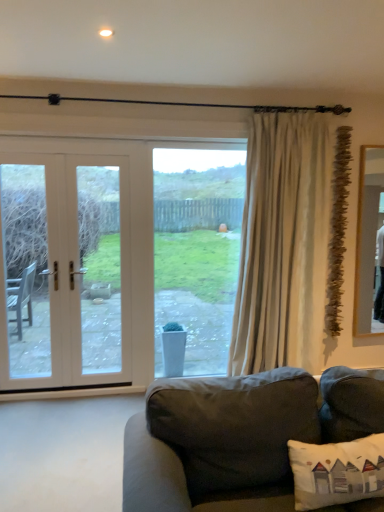
Question: Is white wood door at left not inside white fabric pillow at lower right?

Choices:
 (A) yes
 (B) no

Answer: (A)

Question: Is white wood door at left to the right of white fabric pillow at lower right from the viewer's perspective?

Choices:
 (A) yes
 (B) no

Answer: (B)

Question: Is white wood door at left to the left of white fabric pillow at lower right from the viewer's perspective?

Choices:
 (A) no
 (B) yes

Answer: (B)

Question: Is white fabric pillow at lower right a part of white wood door at left?

Choices:
 (A) no
 (B) yes

Answer: (A)

Question: From the image's perspective, is white wood door at left beneath white fabric pillow at lower right?

Choices:
 (A) no
 (B) yes

Answer: (A)

Question: From a real-world perspective, is white wood door at left located beneath white fabric pillow at lower right?

Choices:
 (A) no
 (B) yes

Answer: (A)

Question: Is dark gray fabric couch at lower center smaller than white wood door at left?

Choices:
 (A) no
 (B) yes

Answer: (A)

Question: Is the position of dark gray fabric couch at lower center less distant than that of white wood door at left?

Choices:
 (A) yes
 (B) no

Answer: (A)

Question: From the image's perspective, would you say dark gray fabric couch at lower center is positioned over white wood door at left?

Choices:
 (A) no
 (B) yes

Answer: (A)

Question: Is dark gray fabric couch at lower center not within white wood door at left?

Choices:
 (A) no
 (B) yes

Answer: (B)

Question: From the image's perspective, does dark gray fabric couch at lower center appear lower than white wood door at left?

Choices:
 (A) yes
 (B) no

Answer: (A)

Question: Would you say dark gray fabric couch at lower center is a long distance from white wood door at left?

Choices:
 (A) no
 (B) yes

Answer: (B)

Question: Is clear glass window at center behind white wood door at left?

Choices:
 (A) yes
 (B) no

Answer: (A)